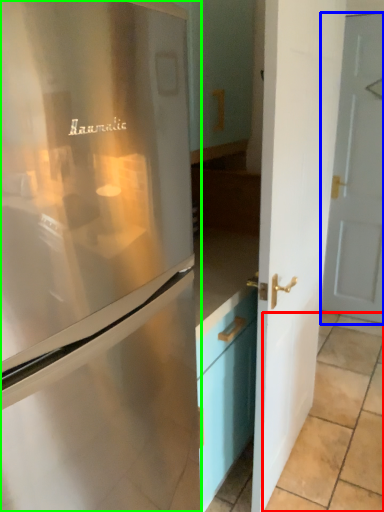
Question: Which is nearer to the tile (highlighted by a red box)? door (highlighted by a blue box) or refrigerator (highlighted by a green box).

Choices:
 (A) door
 (B) refrigerator

Answer: (A)